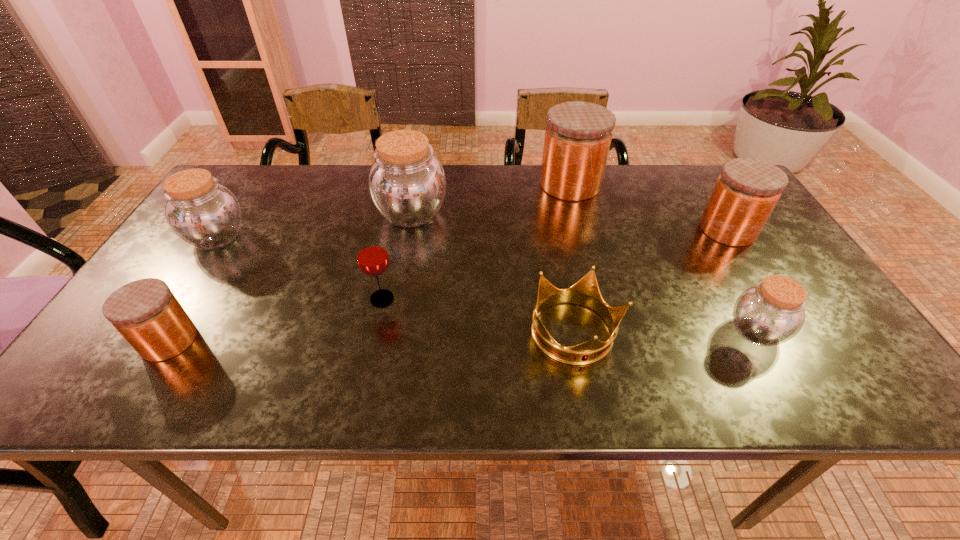
Locate an element on the screen. This screenshot has width=960, height=540. the second orange jar from right to left is located at coordinates (578, 135).

Locate an element on the screen. This screenshot has height=540, width=960. the biggest orange jar is located at coordinates (578, 135).

Where is `the biggest brown jar`? The width and height of the screenshot is (960, 540). the biggest brown jar is located at coordinates (407, 184).

At what (x,y) coordinates should I click in order to perform the action: click on the second brown jar from left to right. Please return your answer as a coordinate pair (x, y). The width and height of the screenshot is (960, 540). Looking at the image, I should click on (407, 184).

The image size is (960, 540). Identify the location of the second biggest orange jar. (747, 190).

Identify the location of the rightmost orange jar. This screenshot has width=960, height=540. (747, 190).

This screenshot has height=540, width=960. I want to click on the second biggest brown jar, so click(203, 213).

You are a GUI agent. You are given a task and a screenshot of the screen. Output one action in this format:
    pyautogui.click(x=<x>, y=<y>)
    Task: Click on the glass
    The width and height of the screenshot is (960, 540).
    Given the screenshot: What is the action you would take?
    pyautogui.click(x=372, y=256)

This screenshot has height=540, width=960. I want to click on the nearest orange jar, so click(x=145, y=312).

Image resolution: width=960 pixels, height=540 pixels. Find the location of `the leftmost orange jar`. the leftmost orange jar is located at coordinates (145, 312).